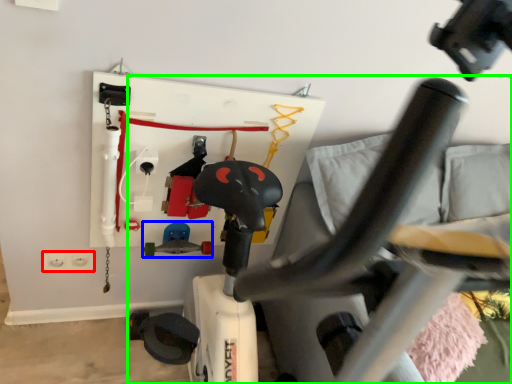
Question: Which is farther away from electric outlet (highlighted by a red box)? toy (highlighted by a blue box) or swivel chair (highlighted by a green box)?

Choices:
 (A) toy
 (B) swivel chair

Answer: (B)